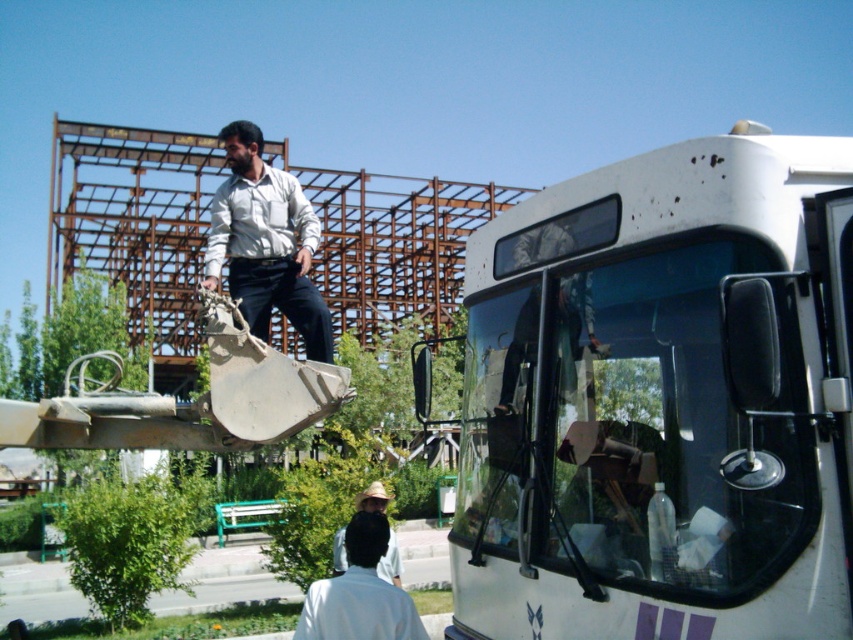
You are a safety inspector observing the construction site. You notice two workers wearing white shirts. One is labeled as the white shirt at upper center and the other as the white matte shirt at lower center. Based on their positions, which worker is standing at a higher elevation?

The white shirt at upper center is taller than the white matte shirt at lower center, so the worker in the white shirt at upper center is standing at a higher elevation.

You are an inspector looking at the construction site. You notice two workers wearing shirts. One is the white shirt at upper center and the other is the white matte shirt at lower center. Which worker is positioned higher in the image?

The white shirt at upper center is positioned higher in the image than the white matte shirt at lower center.